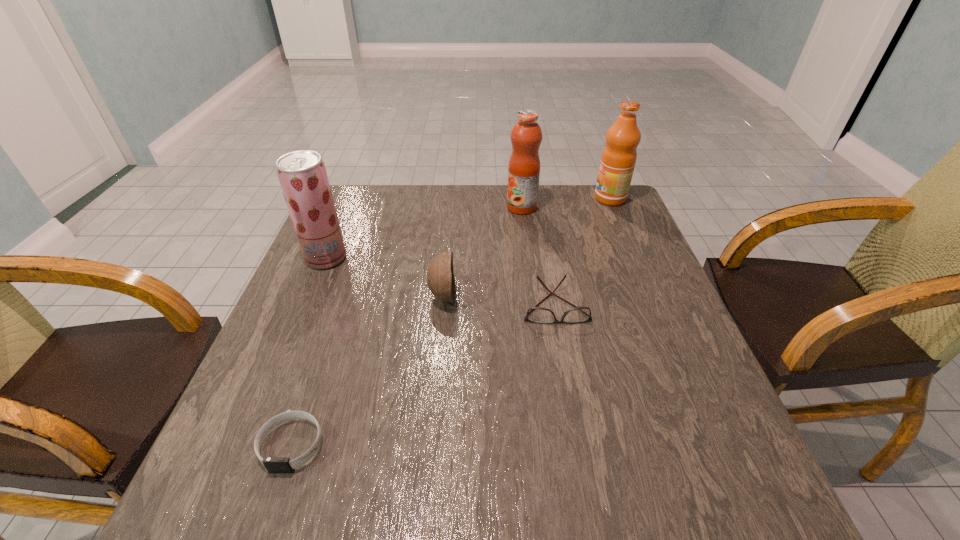
In order to click on wristband that is positioned at the left edge in this screenshot , I will do `click(273, 464)`.

The image size is (960, 540). I want to click on object located in the right edge section of the desktop, so tap(618, 159).

At what (x,y) coordinates should I click in order to perform the action: click on object that is at the near left corner. Please return your answer as a coordinate pair (x, y). The height and width of the screenshot is (540, 960). Looking at the image, I should click on (273, 464).

You are a GUI agent. You are given a task and a screenshot of the screen. Output one action in this format:
    pyautogui.click(x=<x>, y=<y>)
    Task: Click on the object that is at the far right corner
    Image resolution: width=960 pixels, height=540 pixels.
    Given the screenshot: What is the action you would take?
    pyautogui.click(x=618, y=159)

Where is `vacant area at the far edge of the desktop`? Image resolution: width=960 pixels, height=540 pixels. vacant area at the far edge of the desktop is located at coordinates (482, 195).

Locate an element on the screen. free region at the near edge of the desktop is located at coordinates tap(308, 519).

In the image, there is a desktop. At what (x,y) coordinates should I click in order to perform the action: click on vacant space at the left edge. Please return your answer as a coordinate pair (x, y). This screenshot has width=960, height=540. Looking at the image, I should click on (260, 358).

Image resolution: width=960 pixels, height=540 pixels. In order to click on vacant space at the right edge of the desktop in this screenshot , I will do `click(693, 348)`.

Identify the location of vacant space at the far right corner. This screenshot has width=960, height=540. (582, 215).

Where is `vacant space at the near right corner of the desktop`? This screenshot has height=540, width=960. vacant space at the near right corner of the desktop is located at coordinates (706, 514).